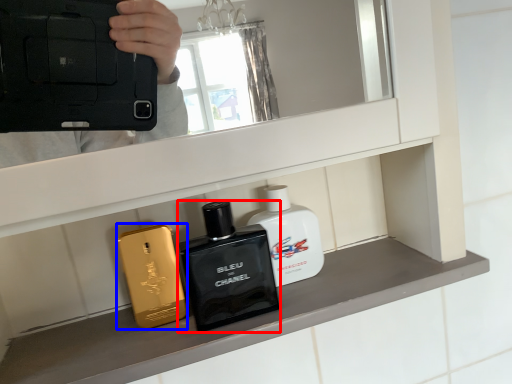
Question: Which object appears closest to the camera in this image, toiletry (highlighted by a red box) or perfume (highlighted by a blue box)?

Choices:
 (A) toiletry
 (B) perfume

Answer: (A)